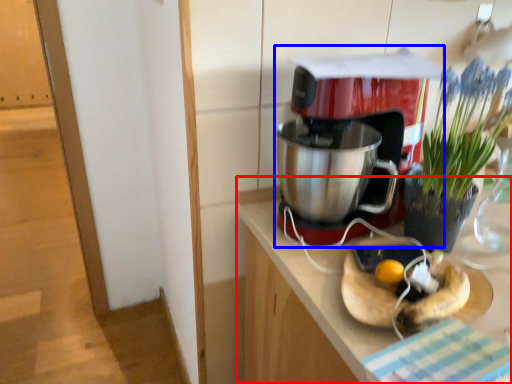
Question: Which object is further to the camera taking this photo, counter (highlighted by a red box) or coffee maker (highlighted by a blue box)?

Choices:
 (A) counter
 (B) coffee maker

Answer: (B)